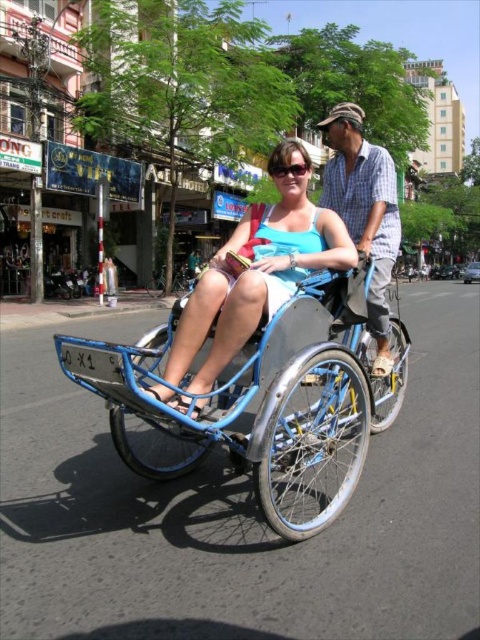
In the scene shown: What is the exact coordinate of the blue plaid shirt at center?

The blue plaid shirt at center is located at coordinate point [364,211].

You are a delivery person needing to carry a package from the store to a customer. The store is located near the matte blue wheelchair at center, and the customer is waiting near the blue plaid shirt at center. Can you pass through the space between these two objects?

The matte blue wheelchair at center is thinner than the blue plaid shirt at center. Since the distance between them is not specified, but the wheelchair is thinner, it might be possible to pass through if the space is sufficient. However, without exact measurements, it is uncertain. Please check the actual space available.

You are a pedestrian standing on the sidewalk and see the matte blue wheelchair at center and the blue plaid shirt at center. Which object is closer to the left side of the sidewalk?

The matte blue wheelchair at center is closer to the left side of the sidewalk because it is positioned to the left of the blue plaid shirt at center.